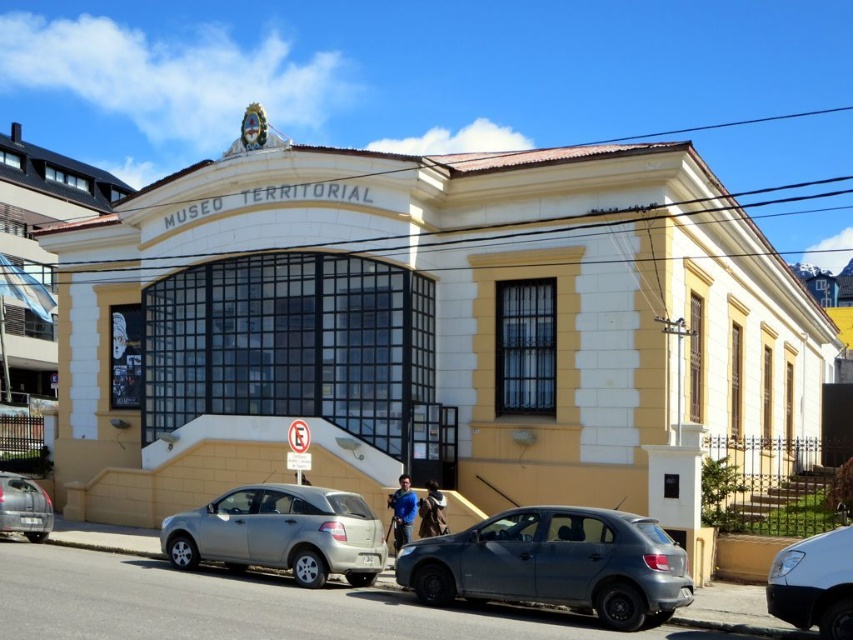
Which of these two, matte gray hatchback at lower center or silver metallic hatchback at lower left, stands taller?

matte gray hatchback at lower center

Is matte gray hatchback at lower center smaller than silver metallic hatchback at lower left?

No.

Where is `matte gray hatchback at lower center`? Image resolution: width=853 pixels, height=640 pixels. matte gray hatchback at lower center is located at coordinates (555, 564).

Is silver metallic hatchback at lower left further to the viewer compared to silver metallic car at lower left?

No, it is not.

Who is lower down, silver metallic hatchback at lower left or silver metallic car at lower left?

silver metallic car at lower left is below.

Locate an element on the screen. silver metallic hatchback at lower left is located at coordinates (281, 532).

In the scene shown: Is matte gray hatchback at lower center positioned before silver metallic car at lower left?

Yes, it is in front of silver metallic car at lower left.

Describe the element at coordinates (555, 564) in the screenshot. I see `matte gray hatchback at lower center` at that location.

Is point (668, 563) farther from viewer compared to point (10, 518)?

No, (668, 563) is in front of (10, 518).

I want to click on matte gray hatchback at lower center, so click(x=555, y=564).